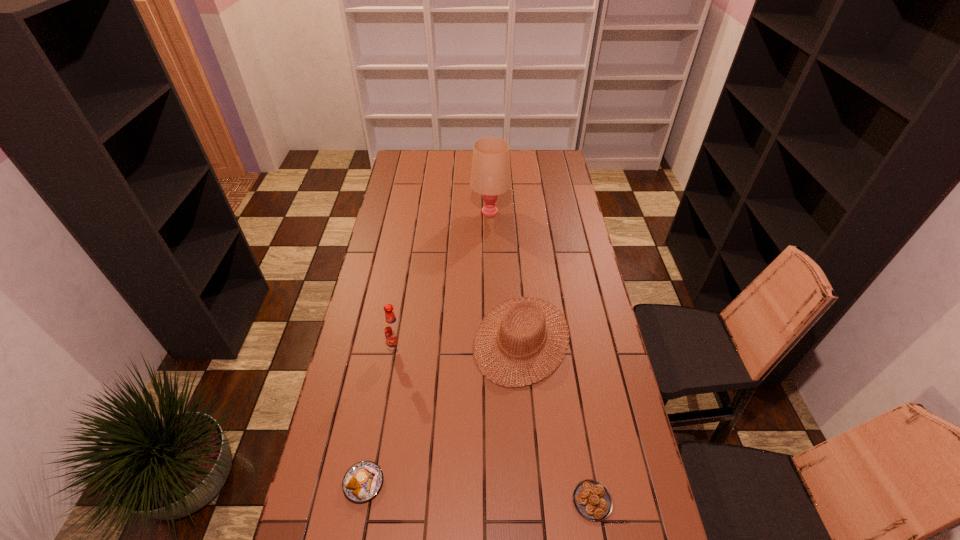
This screenshot has width=960, height=540. I want to click on the second closest object to the left pastry, so click(x=393, y=330).

You are a GUI agent. You are given a task and a screenshot of the screen. Output one action in this format:
    pyautogui.click(x=<x>, y=<y>)
    Task: Click on the vacant space that satisfies the following two spatial constraints: 1. on the back side of the second shortest object; 2. on the left side of the root beer
    
    Given the screenshot: What is the action you would take?
    pyautogui.click(x=388, y=349)

Where is `free region that satisfies the following two spatial constraints: 1. on the front side of the right pastry; 2. on the right side of the sunhat`? This screenshot has height=540, width=960. free region that satisfies the following two spatial constraints: 1. on the front side of the right pastry; 2. on the right side of the sunhat is located at coordinates (535, 501).